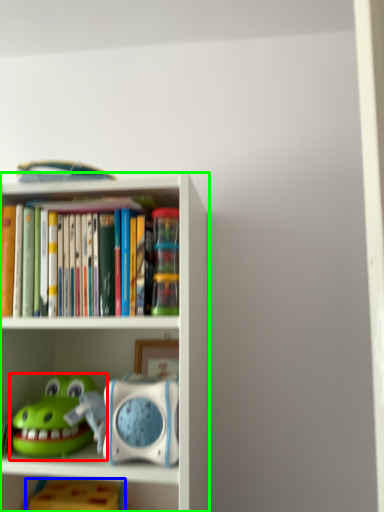
Question: Which object is positioned closest to toy (highlighted by a red box)? Select from toy (highlighted by a blue box) and shelf (highlighted by a green box).

Choices:
 (A) toy
 (B) shelf

Answer: (B)